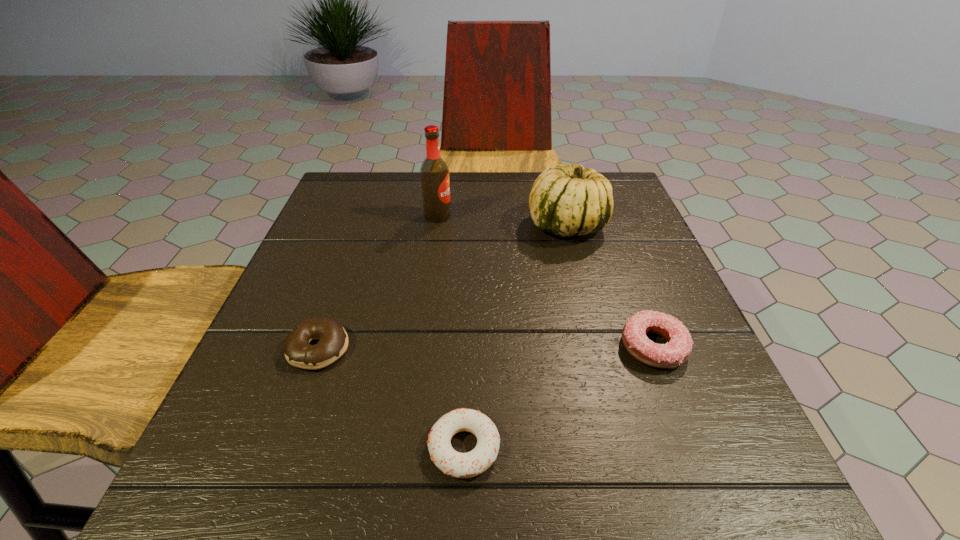
Where is `blank space located on the left of the nearest object`? blank space located on the left of the nearest object is located at coordinates (229, 448).

Find the location of a particular element. beer bottle located in the far edge section of the desktop is located at coordinates (434, 172).

Where is `gourd that is at the far edge`? The height and width of the screenshot is (540, 960). gourd that is at the far edge is located at coordinates (566, 200).

Identify the location of object positioned at the near edge. This screenshot has width=960, height=540. (459, 465).

You are a GUI agent. You are given a task and a screenshot of the screen. Output one action in this format:
    pyautogui.click(x=<x>, y=<y>)
    Task: Click on the object at the left edge
    This screenshot has height=540, width=960.
    Given the screenshot: What is the action you would take?
    pyautogui.click(x=333, y=340)

I want to click on gourd present at the right edge, so click(x=566, y=200).

Where is `doughnut that is at the right edge`? The image size is (960, 540). doughnut that is at the right edge is located at coordinates [676, 351].

Where is `object that is at the far right corner`? object that is at the far right corner is located at coordinates (566, 200).

In the image, there is a desktop. Where is `vacant space at the far edge`? Image resolution: width=960 pixels, height=540 pixels. vacant space at the far edge is located at coordinates (471, 173).

Where is `vacant space at the left edge of the desktop`? vacant space at the left edge of the desktop is located at coordinates (364, 237).